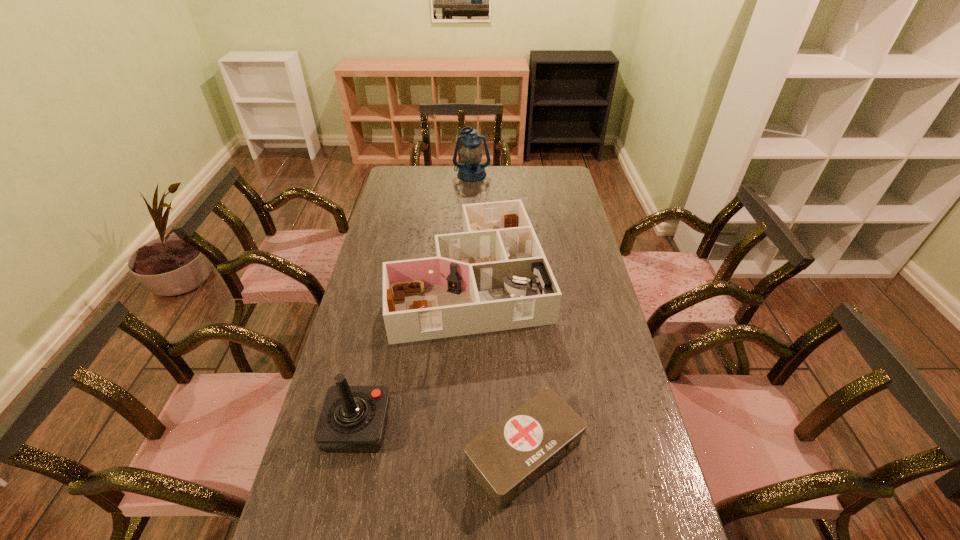
In order to click on object that is the second nearest to the dollhouse in this screenshot , I will do `click(507, 458)`.

Select which object appears as the closest to the third nearest object. Please provide its 2D coordinates. Your answer should be formatted as a tuple, i.e. [(x, y)], where the tuple contains the x and y coordinates of a point satisfying the conditions above.

[(353, 418)]

The height and width of the screenshot is (540, 960). In order to click on vacant space that satisfies the following two spatial constraints: 1. on the face of the lantern; 2. on the front-facing side of the joystick in this screenshot , I will do `click(465, 427)`.

Identify the location of free space that satisfies the following two spatial constraints: 1. on the front-facing side of the first-aid kit; 2. on the right side of the joystick. (351, 454).

Where is `vacant space that satisfies the following two spatial constraints: 1. on the front side of the first-aid kit; 2. on the right side of the second farthest object`? vacant space that satisfies the following two spatial constraints: 1. on the front side of the first-aid kit; 2. on the right side of the second farthest object is located at coordinates (466, 454).

The height and width of the screenshot is (540, 960). In order to click on free space that satisfies the following two spatial constraints: 1. on the front-facing side of the joystick; 2. on the right side of the shortest object in this screenshot , I will do click(x=351, y=454).

The width and height of the screenshot is (960, 540). I want to click on free space that satisfies the following two spatial constraints: 1. on the face of the lantern; 2. on the left side of the dollhouse, so click(x=469, y=277).

Locate an element on the screen. This screenshot has height=540, width=960. free space that satisfies the following two spatial constraints: 1. on the face of the farthest object; 2. on the right side of the second shortest object is located at coordinates 469,277.